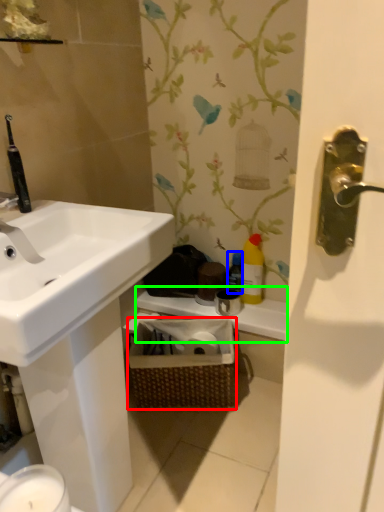
Question: Which is nearer to the basket (highlighted by a red box)? bottle (highlighted by a blue box) or counter top (highlighted by a green box).

Choices:
 (A) bottle
 (B) counter top

Answer: (B)